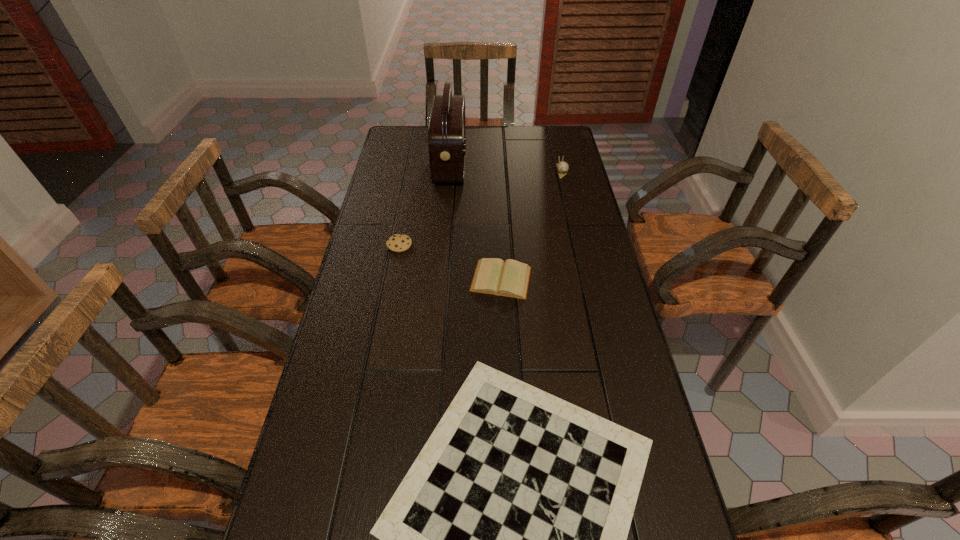
Identify the location of the tallest object. The image size is (960, 540). (447, 131).

Find the location of a particular element. This screenshot has width=960, height=540. escargot is located at coordinates (562, 167).

Where is `the leftmost object`? the leftmost object is located at coordinates (398, 242).

The height and width of the screenshot is (540, 960). In order to click on the third tallest object in this screenshot , I will do click(398, 242).

Locate an element on the screen. The image size is (960, 540). the fourth tallest object is located at coordinates (492, 276).

At what (x,y) coordinates should I click in order to perform the action: click on the second nearest object. Please return your answer as a coordinate pair (x, y). The image size is (960, 540). Looking at the image, I should click on (492, 276).

This screenshot has width=960, height=540. Identify the location of vacant space located 0.280m on the front panel of the radio receiver. (536, 165).

Locate an element on the screen. The image size is (960, 540). free space located on the shell of the escargot is located at coordinates (565, 188).

Where is `vacant space located on the right of the third nearest object`? Image resolution: width=960 pixels, height=540 pixels. vacant space located on the right of the third nearest object is located at coordinates (430, 245).

Find the location of `vacant space located on the left of the diary`. vacant space located on the left of the diary is located at coordinates (433, 279).